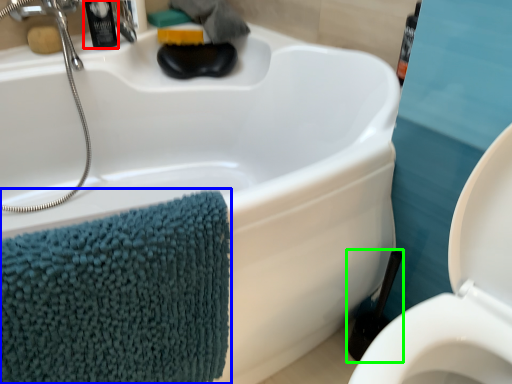
Question: Which object is the farthest from toiletry (highlighted by a red box)? Choose among these: bath towel (highlighted by a blue box) or brush (highlighted by a green box).

Choices:
 (A) bath towel
 (B) brush

Answer: (B)